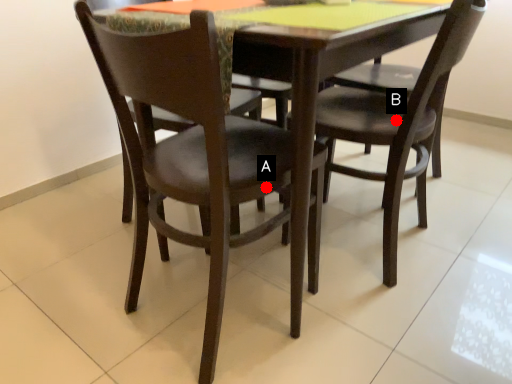
Question: Two points are circled on the image, labeled by A and B beside each circle. Which point appears closest to the camera in this image?

Choices:
 (A) A is closer
 (B) B is closer

Answer: (A)